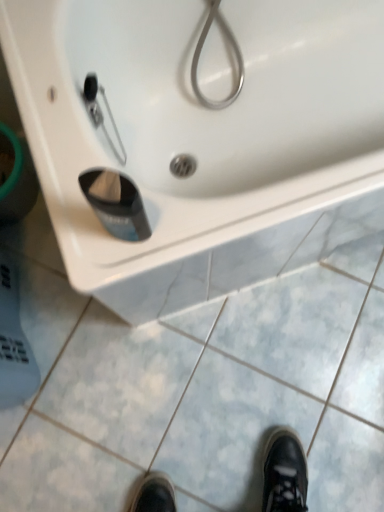
This screenshot has width=384, height=512. Describe the element at coordinates (118, 208) in the screenshot. I see `black plastic cup at lower center` at that location.

Find the location of a particular element. This screenshot has height=512, width=384. white glossy sink at upper center is located at coordinates (201, 382).

Locate an element on the screen. This screenshot has height=512, width=384. white glossy sink at upper center is located at coordinates (198, 137).

From the image's perspective, does white glossy sink at upper center appear lower than white glossy sink at upper center?

Correct, white glossy sink at upper center appears lower than white glossy sink at upper center in the image.

Looking at this image, could you tell me if white glossy sink at upper center is facing white glossy sink at upper center?

No, white glossy sink at upper center is not oriented towards white glossy sink at upper center.

In the scene shown: Can you confirm if white glossy sink at upper center is thinner than white glossy sink at upper center?

In fact, white glossy sink at upper center might be wider than white glossy sink at upper center.

Locate an element on the screen. This screenshot has height=512, width=384. tile located below the white glossy sink at upper center (from the image's perspective) is located at coordinates (201, 382).

Is white glossy sink at upper center next to white glossy sink at upper center and touching it?

No, white glossy sink at upper center is not with white glossy sink at upper center.

Based on their positions, is white glossy sink at upper center located to the left or right of white glossy sink at upper center?

In the image, white glossy sink at upper center appears on the right side of white glossy sink at upper center.

From the image's perspective, relative to white glossy sink at upper center, is white glossy sink at upper center above or below?

Based on their image positions, white glossy sink at upper center is located above white glossy sink at upper center.

The height and width of the screenshot is (512, 384). In order to click on tile below the white glossy sink at upper center (from the image's perspective) in this screenshot , I will do `click(201, 382)`.

Identify the location of liquid that appears in front of the white glossy sink at upper center. Image resolution: width=384 pixels, height=512 pixels. (118, 208).

From the picture: Is white glossy sink at upper center oriented away from black plastic cup at lower center?

white glossy sink at upper center is not turned away from black plastic cup at lower center.

Consider the image. Does white glossy sink at upper center have a smaller size compared to black plastic cup at lower center?

Actually, white glossy sink at upper center might be larger than black plastic cup at lower center.

Does black plastic cup at lower center come in front of white glossy sink at upper center?

Yes, it is.

Is black plastic cup at lower center facing away from white glossy sink at upper center?

No, white glossy sink at upper center is not at the back of black plastic cup at lower center.

Which is closer, [120,227] or [370,162]?

Clearly, point [120,227] is closer to the camera than point [370,162].

Considering the relative sizes of black plastic cup at lower center and white glossy sink at upper center in the image provided, is black plastic cup at lower center bigger than white glossy sink at upper center?

No, black plastic cup at lower center is not bigger than white glossy sink at upper center.

Which of these two, black plastic cup at lower center or white glossy sink at upper center, is thinner?

Thinner between the two is black plastic cup at lower center.

Locate an element on the screen. liquid on the left of white glossy sink at upper center is located at coordinates (118, 208).

From a real-world perspective, is white glossy sink at upper center physically located above or below black plastic cup at lower center?

white glossy sink at upper center is below black plastic cup at lower center.

Can you tell me how much white glossy sink at upper center and black plastic cup at lower center differ in facing direction?

The facing directions of white glossy sink at upper center and black plastic cup at lower center are 0.00236 degrees apart.

Would you say black plastic cup at lower center is part of white glossy sink at upper center's contents?

No, black plastic cup at lower center is not surrounded by white glossy sink at upper center.

Between white glossy sink at upper center and black plastic cup at lower center, which one has smaller size?

Smaller between the two is black plastic cup at lower center.

Find the location of a particular element. sink that is above the white glossy sink at upper center (from a real-world perspective) is located at coordinates (198, 137).

The width and height of the screenshot is (384, 512). Identify the location of sink lying above the white glossy sink at upper center (from the image's perspective). (198, 137).

Based on their spatial positions, is black plastic cup at lower center or white glossy sink at upper center closer to white glossy sink at upper center?

black plastic cup at lower center is closer to white glossy sink at upper center.

Consider the image. Looking at the image, which one is located further to white glossy sink at upper center, white glossy sink at upper center or black plastic cup at lower center?

Among the two, white glossy sink at upper center is located further to white glossy sink at upper center.

Considering their positions, is white glossy sink at upper center positioned closer to black plastic cup at lower center than white glossy sink at upper center?

The object closer to black plastic cup at lower center is white glossy sink at upper center.

Estimate the real-world distances between objects in this image. Which object is closer to white glossy sink at upper center, black plastic cup at lower center or white glossy sink at upper center?

white glossy sink at upper center.

Which object lies nearer to the anchor point white glossy sink at upper center, white glossy sink at upper center or black plastic cup at lower center?

white glossy sink at upper center is positioned closer to the anchor white glossy sink at upper center.

Looking at the image, which one is located further to black plastic cup at lower center, white glossy sink at upper center or white glossy sink at upper center?

Based on the image, white glossy sink at upper center appears to be further to black plastic cup at lower center.

The width and height of the screenshot is (384, 512). I want to click on liquid between white glossy sink at upper center and white glossy sink at upper center vertically, so click(118, 208).